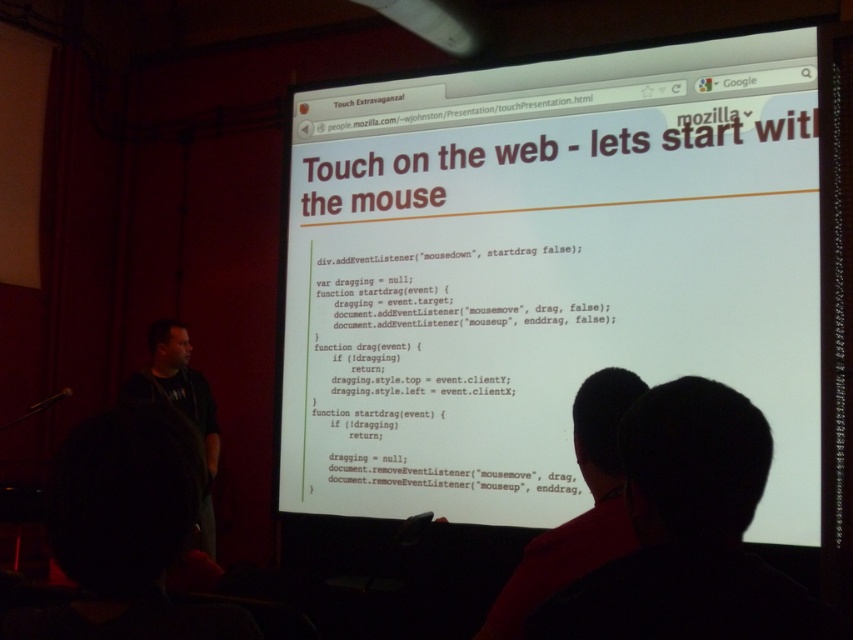
Between point (689, 301) and point (761, 632), which one is positioned behind?

Positioned behind is point (689, 301).

Describe the element at coordinates (546, 273) in the screenshot. I see `white paper at center` at that location.

In order to click on white paper at center in this screenshot , I will do `click(546, 273)`.

In the scene shown: Is black hair at upper center wider than black hair at upper right?

No.

Does black hair at upper center have a smaller size compared to black hair at upper right?

Correct, black hair at upper center occupies less space than black hair at upper right.

The image size is (853, 640). What are the coordinates of `black hair at upper center` in the screenshot? It's located at (688, 532).

Is white paper at center thinner than black hair at upper right?

No, white paper at center is not thinner than black hair at upper right.

Is white paper at center taller than black hair at upper right?

Yes, white paper at center is taller than black hair at upper right.

I want to click on white paper at center, so click(x=546, y=273).